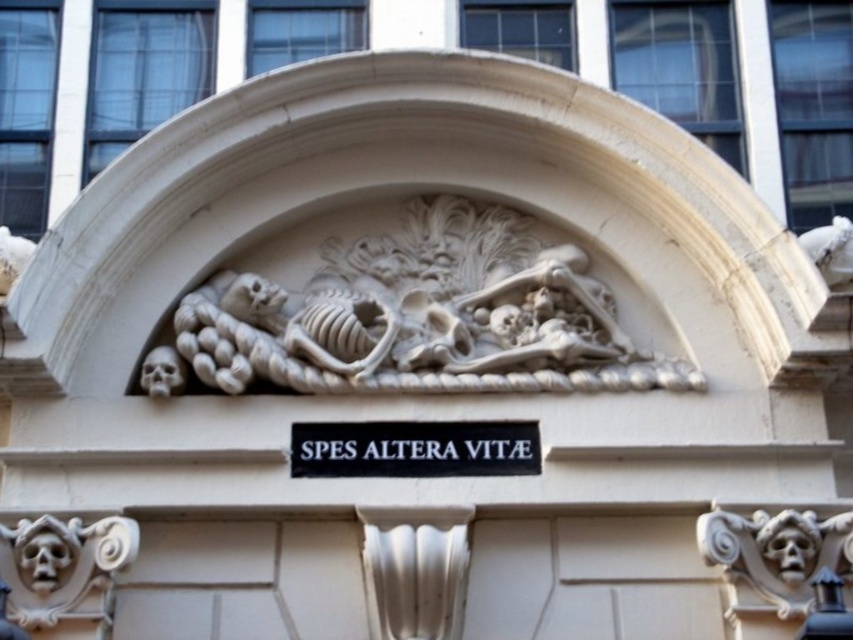
You are an architect examining the building facade. You notice two points marked on the image. The first point is at coordinates point (242, 301) and the second is at point (492, 420). Which point is closer to you when standing directly in front of the building?

Point (242, 301) is closer to you than point (492, 420) because it is further to the viewer.

What is the relationship between the sizes of the white stone skeleton at center and the black matte sign at center in the image?

The white stone skeleton at center is wider than the black matte sign at center.